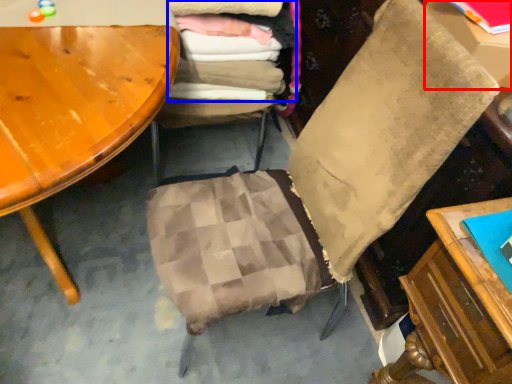
Question: Which of the following is the closest to the observer, table (highlighted by a red box) or laundry (highlighted by a blue box)?

Choices:
 (A) table
 (B) laundry

Answer: (A)